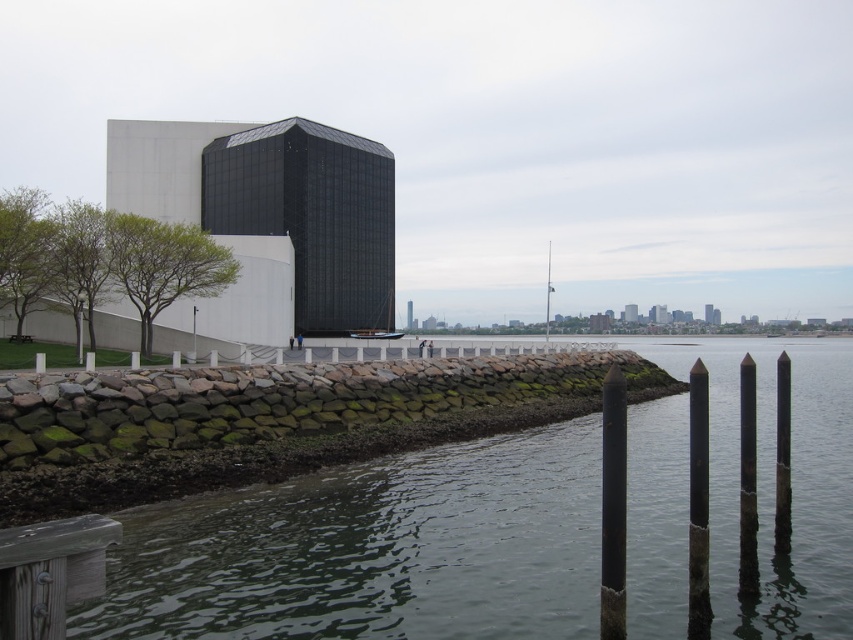
You are standing on the wooden dock at lower left and want to reach the black matte pole at center. Which direction should you move to get closer to the pole?

Since the wooden dock at lower left has a lesser height compared to the black matte pole at center, you should move towards the center of the image to get closer to the pole.

You are standing at the center of the image and want to locate the green stone wall at lower left. According to the coordinates provided, in which direction should you look to find it?

The green stone wall at lower left is located at coordinates point (374, 550), so you should look to the lower left direction to find it.